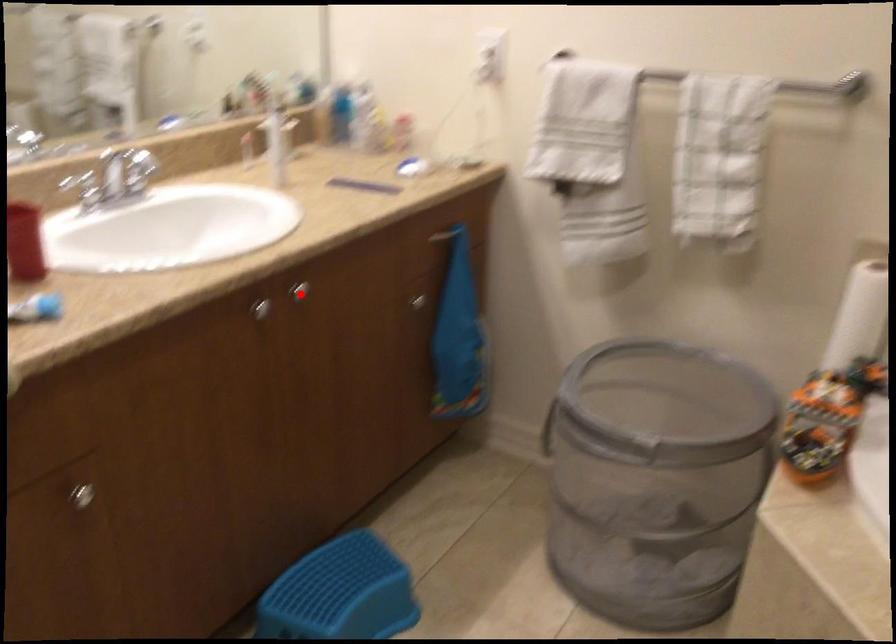
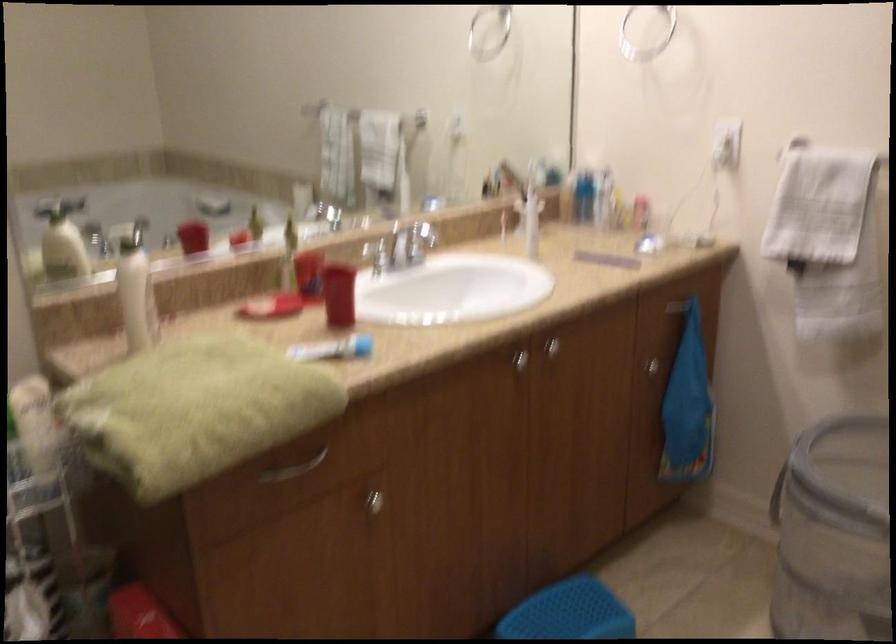
Question: I am providing you with two images of the same scene from different viewpoints. Given a red point in image1, look at the same physical point in image2. Is it:

Choices:
 (A) Closer to the viewpoint
 (B) Farther from the viewpoint

Answer: (B)